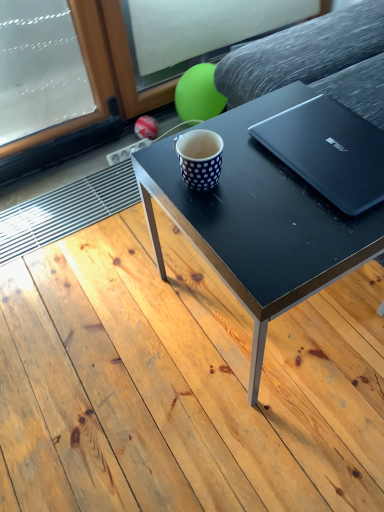
The height and width of the screenshot is (512, 384). Describe the element at coordinates (259, 220) in the screenshot. I see `black matte coffee table at center` at that location.

The image size is (384, 512). What do you see at coordinates (329, 151) in the screenshot?
I see `black matte laptop at upper right` at bounding box center [329, 151].

Locate an element on the screen. black matte coffee table at center is located at coordinates (259, 220).

Does black matte coffee table at center turn towards black matte table at center?

No.

From a real-world perspective, who is located higher, black matte coffee table at center or black matte table at center?

black matte coffee table at center is physically above.

Can you tell me how much black matte coffee table at center and black matte table at center differ in facing direction?

They differ by 89.2 degrees in their facing directions.

Is black matte coffee table at center behind black matte table at center?

Yes.

From a real-world perspective, is black matte table at center over white dotted mug at center?

No.

Who is shorter, black matte table at center or white dotted mug at center?

white dotted mug at center.

Is black matte table at center wider than white dotted mug at center?

Indeed, black matte table at center has a greater width compared to white dotted mug at center.

Is black matte table at center bigger than white dotted mug at center?

Yes.

Are black matte coffee table at center and white dotted mug at center located far from each other?

No, black matte coffee table at center is not far from white dotted mug at center.

From the picture: Considering the sizes of black matte coffee table at center and white dotted mug at center in the image, is black matte coffee table at center wider or thinner than white dotted mug at center?

In the image, black matte coffee table at center appears to be wider than white dotted mug at center.

Which is closer, (254, 142) or (202, 187)?

Point (254, 142) is farther from the camera than point (202, 187).

You are a GUI agent. You are given a task and a screenshot of the screen. Output one action in this format:
    pyautogui.click(x=<x>, y=<y>)
    Task: Click on the coffee table below the white dotted mug at center (from a real-world perspective)
    This screenshot has height=512, width=384.
    Given the screenshot: What is the action you would take?
    pyautogui.click(x=259, y=220)

Is black matte table at center inside the boundaries of black matte coffee table at center, or outside?

black matte table at center exists outside the volume of black matte coffee table at center.

In the scene shown: Is black matte table at center facing towards black matte coffee table at center?

Yes, black matte table at center is facing black matte coffee table at center.

From a real-world perspective, which object rests below the other?

black matte table at center.

Is point (366, 199) more distant than point (214, 228)?

No, it is not.

Is black matte laptop at upper right next to black matte coffee table at center?

No, black matte laptop at upper right is not making contact with black matte coffee table at center.

Considering the sizes of objects black matte laptop at upper right and black matte coffee table at center in the image provided, who is smaller, black matte laptop at upper right or black matte coffee table at center?

black matte laptop at upper right is smaller.

From the picture: From the image's perspective, is white dotted mug at center located above or below black matte laptop at upper right?

white dotted mug at center is situated lower than black matte laptop at upper right in the image.

Considering the relative sizes of white dotted mug at center and black matte laptop at upper right in the image provided, is white dotted mug at center shorter than black matte laptop at upper right?

Incorrect, the height of white dotted mug at center does not fall short of that of black matte laptop at upper right.

Which object is wider, white dotted mug at center or black matte laptop at upper right?

With larger width is black matte laptop at upper right.

Which is behind, point (287, 399) or point (284, 119)?

The point (287, 399) is farther from the camera.

Which object is more forward, black matte table at center or black matte laptop at upper right?

Positioned in front is black matte table at center.

From a real-world perspective, which object rests below the other?

In real-world perspective, black matte table at center is lower.

Considering the relative sizes of black matte table at center and black matte laptop at upper right in the image provided, is black matte table at center thinner than black matte laptop at upper right?

No, black matte table at center is not thinner than black matte laptop at upper right.

What are the coordinates of `plank below the black matte coffee table at center (from the image's perspective)` in the screenshot? It's located at (181, 384).

Identify the location of coffee cup that appears above the black matte table at center (from a real-world perspective). This screenshot has width=384, height=512. (200, 158).

Which object lies further to the anchor point white dotted mug at center, black matte table at center or black matte laptop at upper right?

Based on the image, black matte table at center appears to be further to white dotted mug at center.

Estimate the real-world distances between objects in this image. Which object is closer to black matte coffee table at center, white dotted mug at center or black matte laptop at upper right?

The object closer to black matte coffee table at center is black matte laptop at upper right.

Looking at the image, which one is located further to black matte coffee table at center, black matte table at center or white dotted mug at center?

The object further to black matte coffee table at center is black matte table at center.

Considering their positions, is black matte laptop at upper right positioned closer to white dotted mug at center than black matte table at center?

black matte laptop at upper right lies closer to white dotted mug at center than the other object.

Based on their spatial positions, is black matte laptop at upper right or black matte coffee table at center closer to white dotted mug at center?

The object closer to white dotted mug at center is black matte coffee table at center.

Consider the image. Based on their spatial positions, is black matte table at center or black matte laptop at upper right closer to black matte coffee table at center?

black matte laptop at upper right is positioned closer to the anchor black matte coffee table at center.

Consider the image. Which object lies nearer to the anchor point black matte table at center, black matte laptop at upper right or black matte coffee table at center?

Based on the image, black matte coffee table at center appears to be nearer to black matte table at center.

Looking at the image, which one is located closer to black matte table at center, white dotted mug at center or black matte laptop at upper right?

Based on the image, black matte laptop at upper right appears to be nearer to black matte table at center.

Where is `coffee table situated between black matte table at center and black matte laptop at upper right from left to right`? The width and height of the screenshot is (384, 512). coffee table situated between black matte table at center and black matte laptop at upper right from left to right is located at coordinates (259, 220).

I want to click on coffee cup between black matte table at center and black matte coffee table at center in the horizontal direction, so click(200, 158).

Where is `coffee cup between black matte table at center and black matte laptop at upper right from left to right`? The image size is (384, 512). coffee cup between black matte table at center and black matte laptop at upper right from left to right is located at coordinates (200, 158).

Where is `coffee table between white dotted mug at center and black matte laptop at upper right in the horizontal direction`? Image resolution: width=384 pixels, height=512 pixels. coffee table between white dotted mug at center and black matte laptop at upper right in the horizontal direction is located at coordinates (259, 220).